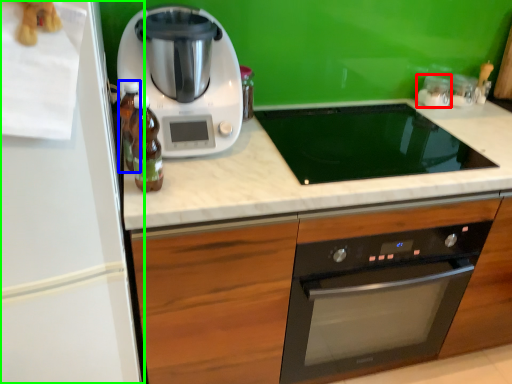
Question: Considering the real-world distances, which object is farthest from appliance (highlighted by a red box)? bottle (highlighted by a blue box) or refrigerator (highlighted by a green box)?

Choices:
 (A) bottle
 (B) refrigerator

Answer: (B)